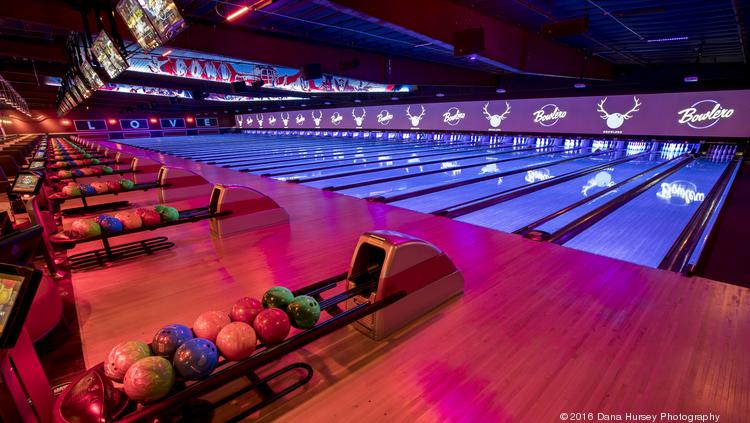
This screenshot has width=750, height=423. I want to click on screens, so click(x=175, y=14), click(x=136, y=35), click(x=116, y=68), click(x=98, y=74), click(x=85, y=90), click(x=79, y=96), click(x=70, y=99), click(x=67, y=104), click(x=62, y=109).